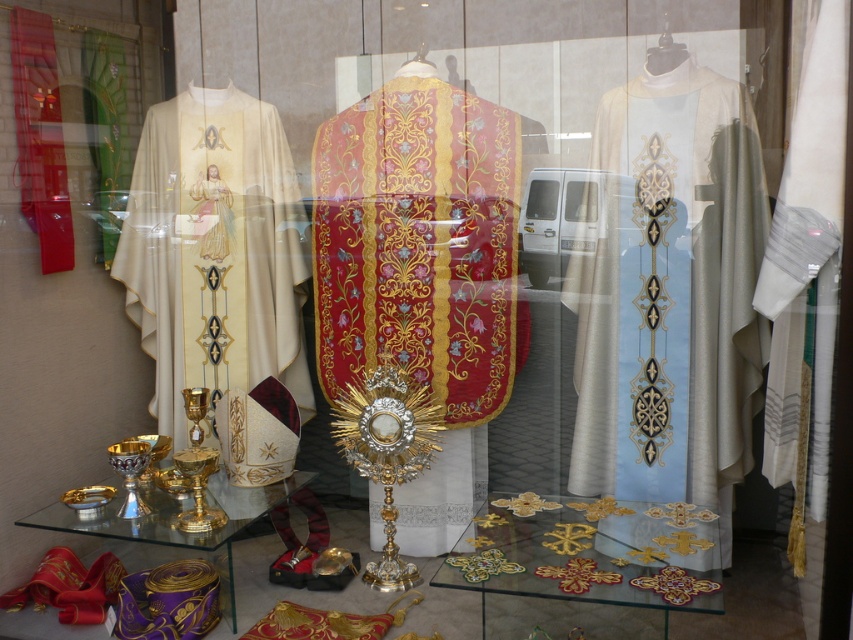
Can you confirm if transparent glass table at center is positioned to the right of transparent glass table at lower left?

Indeed, transparent glass table at center is positioned on the right side of transparent glass table at lower left.

At what (x,y) coordinates should I click in order to perform the action: click on transparent glass table at center. Please return your answer as a coordinate pair (x, y). Image resolution: width=853 pixels, height=640 pixels. Looking at the image, I should click on click(590, 554).

Between light blue silk robe at center and transparent glass table at lower left, which one has more height?

Standing taller between the two is light blue silk robe at center.

Where is `light blue silk robe at center`? Image resolution: width=853 pixels, height=640 pixels. light blue silk robe at center is located at coordinates tap(670, 291).

Does light blue silk robe at center have a smaller size compared to rich red velvet robe at center?

Indeed, light blue silk robe at center has a smaller size compared to rich red velvet robe at center.

Which of these two, light blue silk robe at center or rich red velvet robe at center, stands shorter?

With less height is light blue silk robe at center.

Is point (723, 221) more distant than point (424, 113)?

No, it is in front of (424, 113).

You are a GUI agent. You are given a task and a screenshot of the screen. Output one action in this format:
    pyautogui.click(x=<x>, y=<y>)
    Task: Click on the light blue silk robe at center
    The image size is (853, 640).
    Given the screenshot: What is the action you would take?
    pyautogui.click(x=670, y=291)